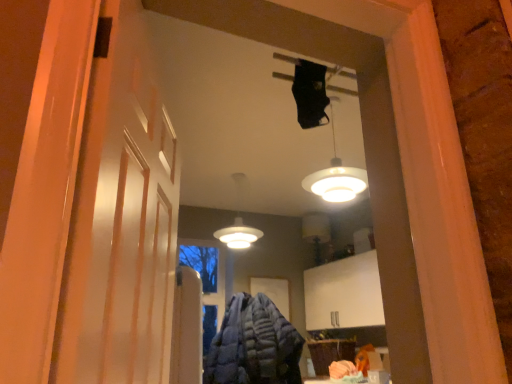
Question: Is white matte barn door at left taller or shorter than blue quilted jacket at center?

Choices:
 (A) short
 (B) tall

Answer: (B)

Question: Considering the positions of white matte barn door at left and blue quilted jacket at center in the image, is white matte barn door at left wider or thinner than blue quilted jacket at center?

Choices:
 (A) wide
 (B) thin

Answer: (B)

Question: Which object is the farthest from the white matte lamp at center, the first lamp when ordered from left to right?

Choices:
 (A) blue quilted jacket at center
 (B) white glossy lampshade at upper center, the 1th lamp positioned from the right
 (C) white matte barn door at left

Answer: (C)

Question: Which object is the farthest from the white matte lamp at center, the first lamp when ordered from left to right?

Choices:
 (A) white matte barn door at left
 (B) blue quilted jacket at center
 (C) white glossy lampshade at upper center, positioned as the second lamp in back-to-front order

Answer: (A)